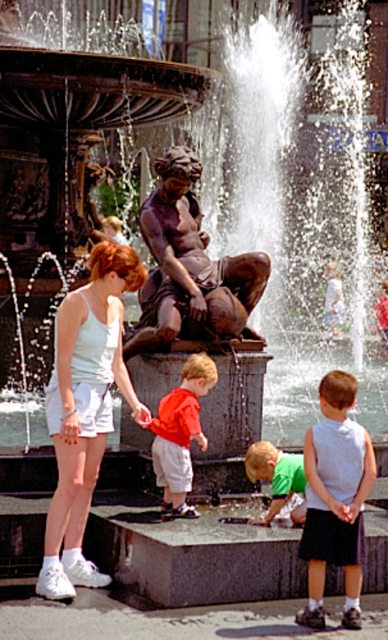
Question: Which object appears farthest from the camera in this image?

Choices:
 (A) red cotton shirt at center
 (B) white cotton tank top at center
 (C) white sleeveless shirt at center
 (D) green t-shirt at lower center

Answer: (A)

Question: In this image, where is bronze statue at center located relative to red cotton shirt at center?

Choices:
 (A) above
 (B) below

Answer: (A)

Question: Which of the following is the closest to the observer?

Choices:
 (A) white cotton tank top at center
 (B) red cotton shirt at center
 (C) white sleeveless shirt at center
 (D) green t-shirt at lower center

Answer: (C)

Question: Which point is closer to the camera taking this photo?

Choices:
 (A) (230, 275)
 (B) (330, 449)
 (C) (303, 493)
 (D) (185, 426)

Answer: (B)

Question: From the image, what is the correct spatial relationship of white cotton tank top at center in relation to bronze statue at center?

Choices:
 (A) above
 (B) below

Answer: (B)

Question: Does white cotton tank top at center have a smaller size compared to white sleeveless shirt at center?

Choices:
 (A) yes
 (B) no

Answer: (B)